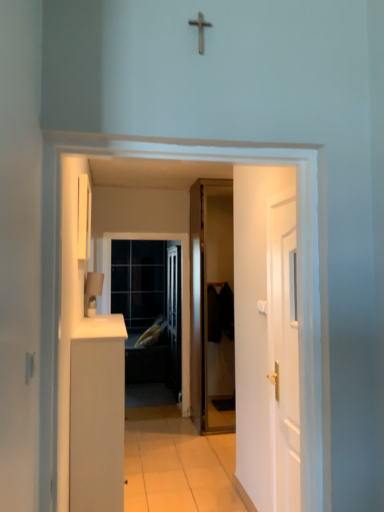
Question: In terms of width, does matte glass screen door at center look wider or thinner when compared to white tile floor at center?

Choices:
 (A) wide
 (B) thin

Answer: (B)

Question: In terms of size, does matte glass screen door at center appear bigger or smaller than white tile floor at center?

Choices:
 (A) big
 (B) small

Answer: (B)

Question: Based on their relative distances, which object is nearer to the white wooden door at right, arranged as the second door when viewed from the left?

Choices:
 (A) transparent glass door at center
 (B) black matte door at center, the 1th door in the left-to-right sequence
 (C) metallic cross at upper center
 (D) matte glass screen door at center
 (E) white matte cabinet at left

Answer: (E)

Question: Considering the real-world distances, which object is closest to the matte glass screen door at center?

Choices:
 (A) metallic cross at upper center
 (B) white matte cabinet at left
 (C) white tile floor at center
 (D) black matte door at center, positioned as the 1th door in back-to-front order
 (E) white wooden door at right, which is the 1th door in front-to-back order

Answer: (D)